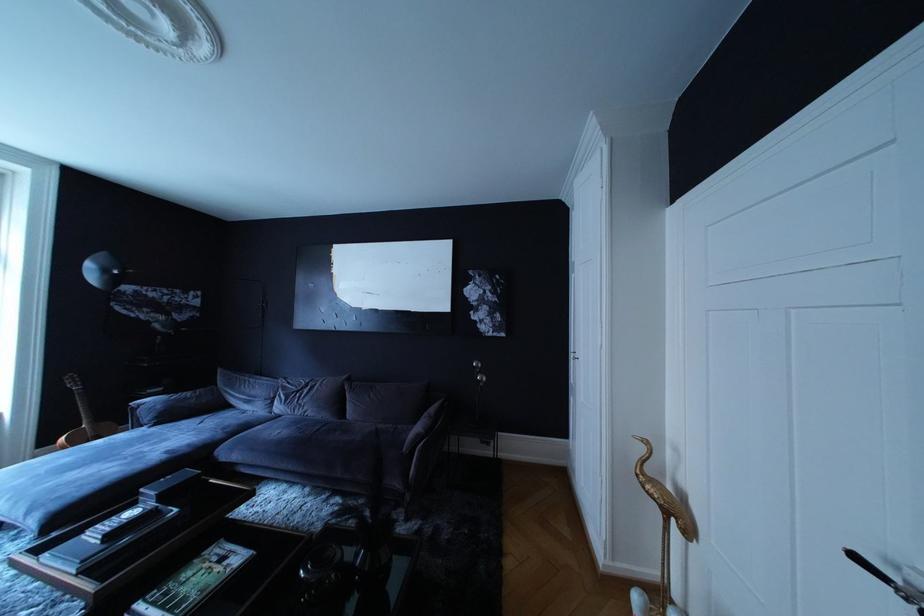
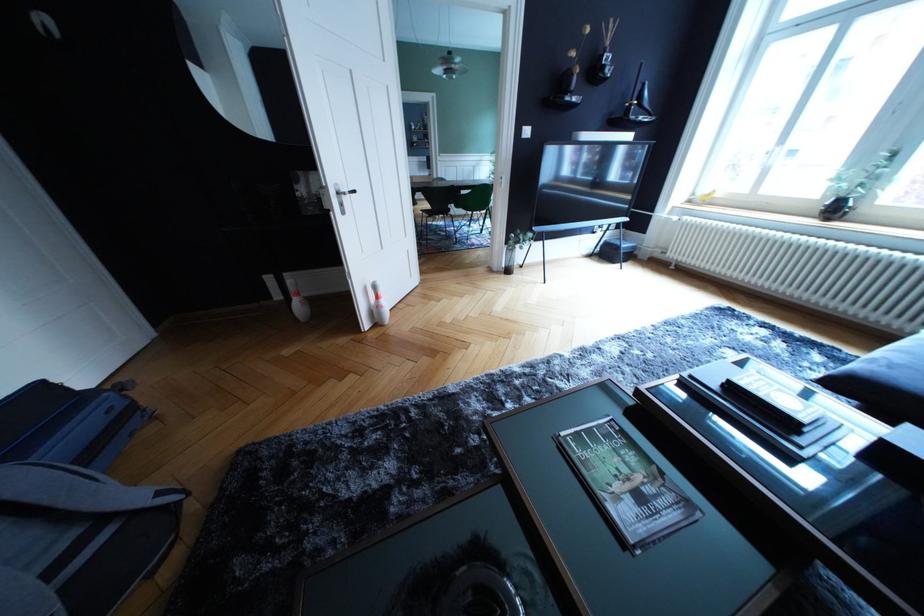
Find the pixel in the second image that matches point (140, 520) in the first image.

(793, 405)